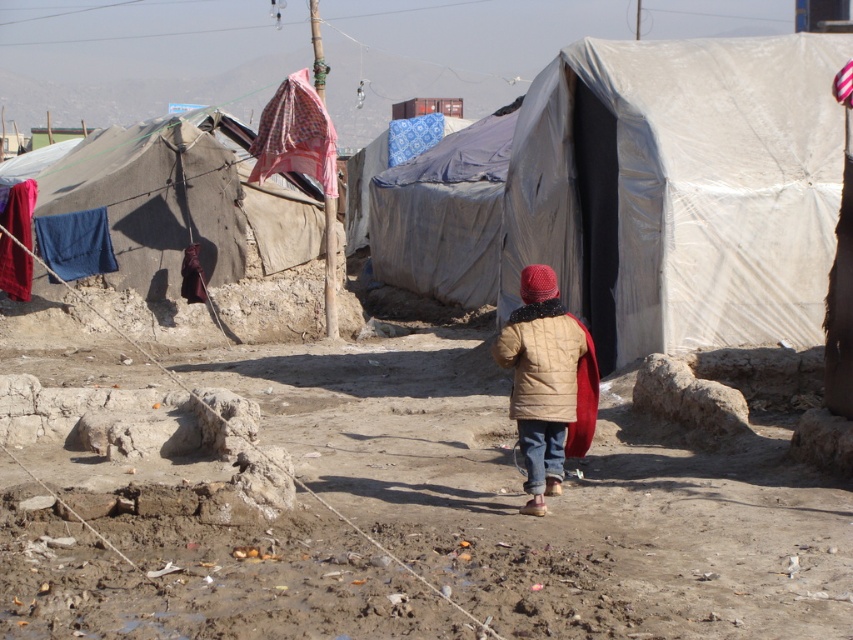
You are a hiker who just arrived at the campsite. You need to set up your tent near the blue tarpaulin tent at center and the patterned fabric at upper center. According to the scene, which object should you place your tent to the left of?

You should place your tent to the left of the blue tarpaulin tent at center because it is to the right of the patterned fabric at upper center.

You are a hiker planning to set up a shelter in this camp area. You notice the beige canvas tent at left and the patterned fabric at upper center. Which object is located above the other?

The beige canvas tent at left is positioned under the patterned fabric at upper center, meaning the patterned fabric at upper center is above it.

You are a hiker who needs to set up a tent. You see a beige canvas tent at left and a patterned fabric at upper center. Which object is located to the left of the other?

The beige canvas tent at left is positioned on the left side of the patterned fabric at upper center.